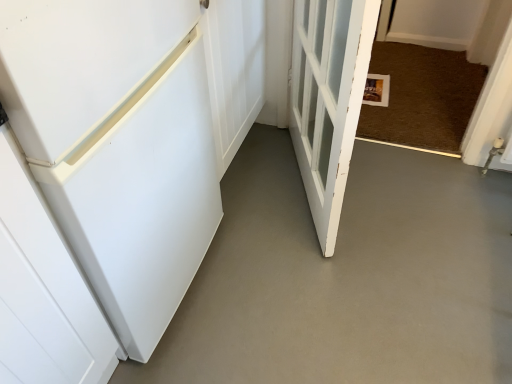
Identify the location of vacant space that is to the left of white wooden door at center, the second door from the left. The width and height of the screenshot is (512, 384). (264, 201).